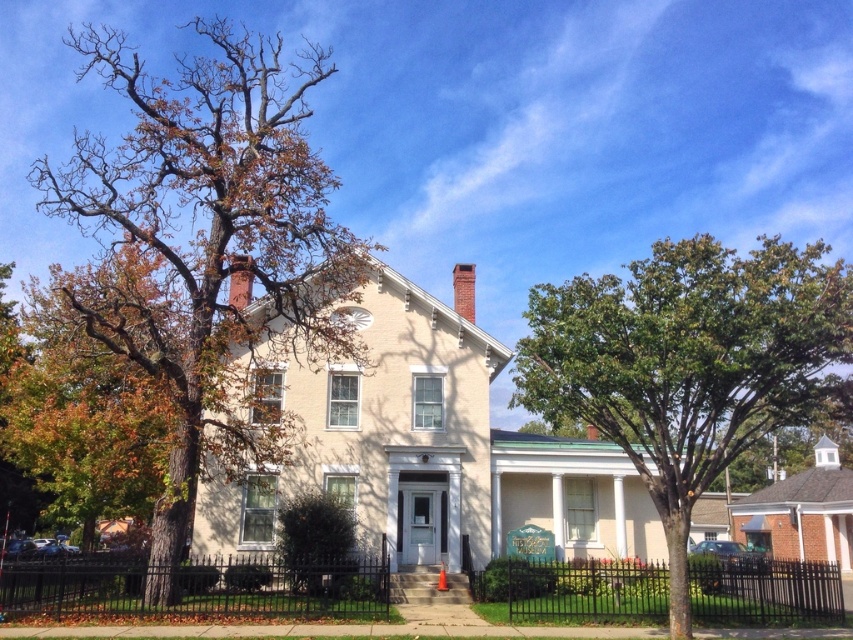
Question: Among these objects, which one is nearest to the camera?

Choices:
 (A) smooth brick chimney at center
 (B) black wrought iron fence at lower center
 (C) brown leafy tree at left

Answer: (C)

Question: Which object is the farthest from the brick chimney at upper center?

Choices:
 (A) black wrought iron fence at lower left
 (B) smooth brick chimney at center
 (C) brown leafy tree at left
 (D) black wrought iron fence at lower center

Answer: (C)

Question: Which object appears farthest from the camera in this image?

Choices:
 (A) green leafy tree at right
 (B) black wrought iron fence at lower center
 (C) brown leafy tree at left

Answer: (B)

Question: Does black wrought iron fence at lower center appear on the left side of smooth brick chimney at center?

Choices:
 (A) yes
 (B) no

Answer: (B)

Question: Is brick chimney at upper center to the right of smooth brick chimney at center from the viewer's perspective?

Choices:
 (A) no
 (B) yes

Answer: (B)

Question: Does brown leafy tree at left have a greater width compared to smooth brick chimney at center?

Choices:
 (A) no
 (B) yes

Answer: (B)